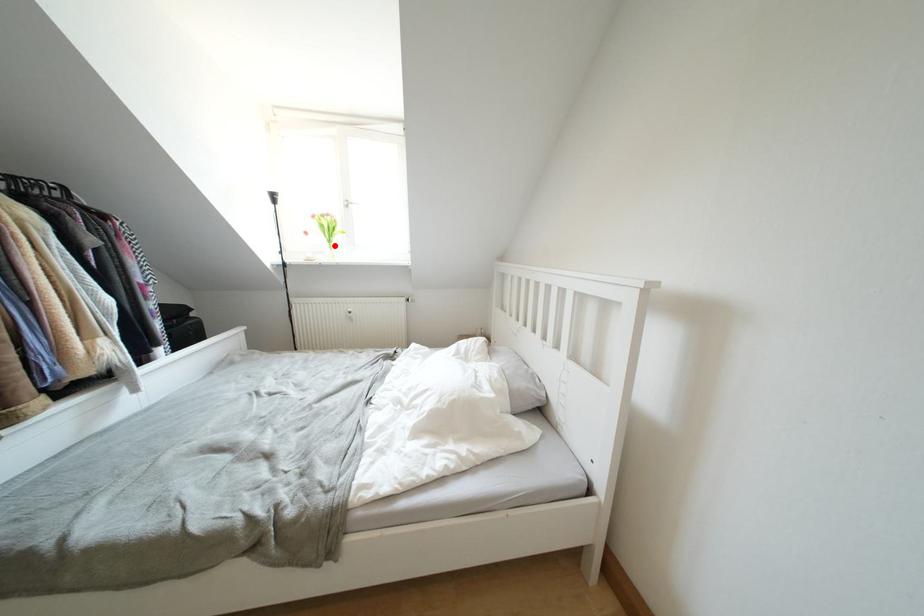
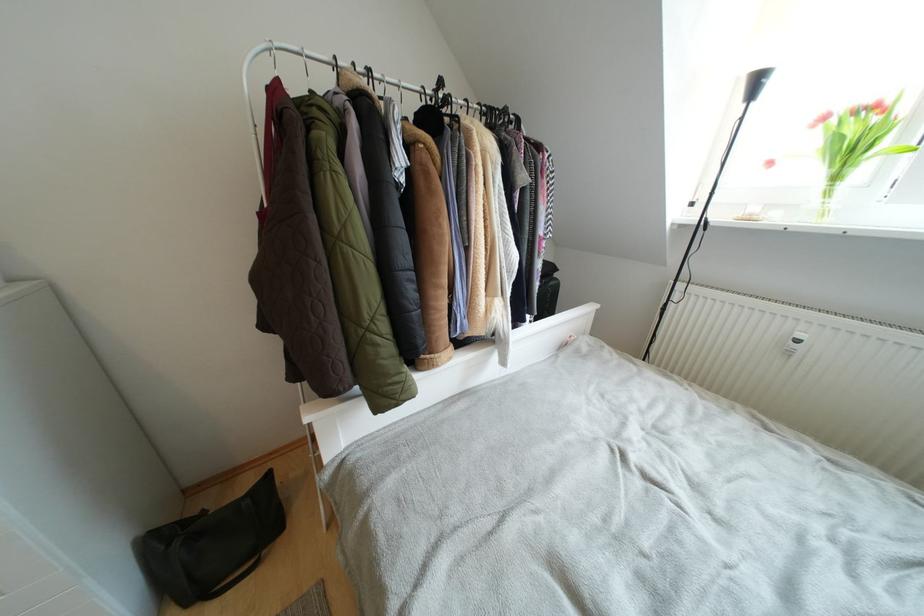
Question: I am providing you with two images of the same scene from different viewpoints. In image1, a red point is highlighted. Considering the same 3D point in image2, which of the following is correct?

Choices:
 (A) It is closer
 (B) It is farther

Answer: (B)